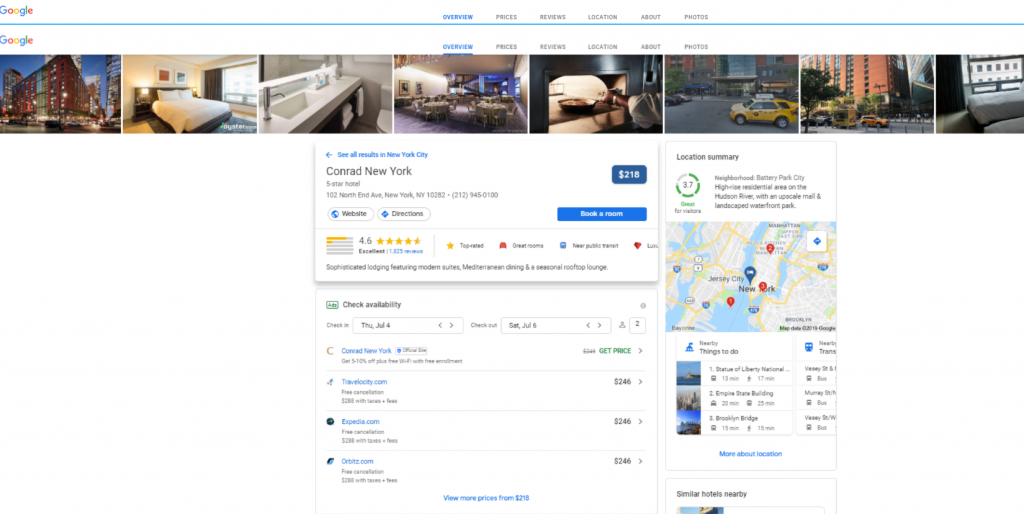
Where is `calendar`? This screenshot has width=1024, height=514. calendar is located at coordinates (333, 242).